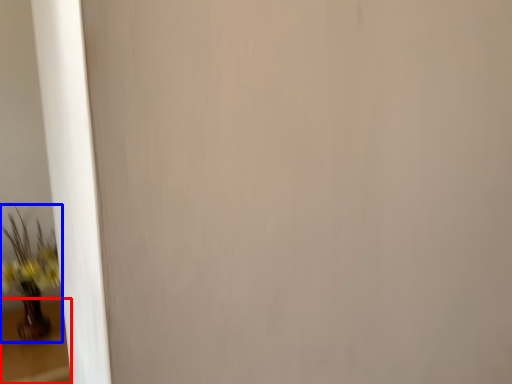
Question: Which object appears closest to the camera in this image, table (highlighted by a red box) or houseplant (highlighted by a blue box)?

Choices:
 (A) table
 (B) houseplant

Answer: (A)